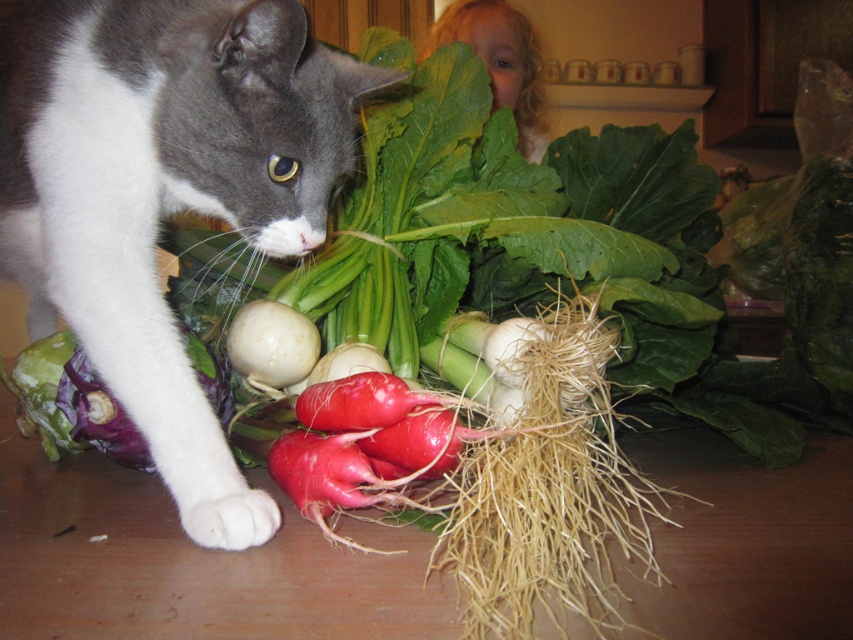
You are a farmer checking the vegetable display. You see the gray fur cat at left and the dry straw roots at center. Which object is positioned higher in the image?

The gray fur cat at left is positioned higher than the dry straw roots at center.

You are a chef preparing a meal and see the gray fur cat at left and the white matte onion at center on your kitchen counter. Which object is closer to the left edge of the counter?

The gray fur cat at left is closer to the left edge of the counter because it is positioned to the left of the white matte onion at center.

You are a chef preparing a vegetable platter and need to choose between the dry straw roots at center and the white matte onion at center. Which object is bigger?

The dry straw roots at center is larger in size compared to the white matte onion at center.